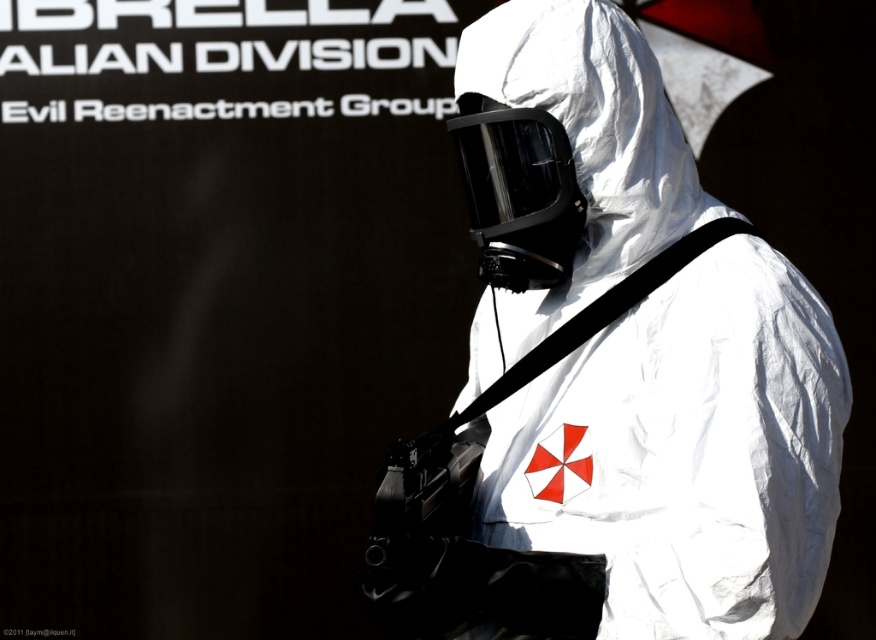
You are a security guard in a high security facility. You need to locate the white matte hazmat suit at center. According to the coordinates provided, where would you find it?

The white matte hazmat suit at center is located at coordinates point [612,374].

You are a security guard in a restricted area. You see a white matte hazmat suit at center and a white matte helmet at center. Which object is located to the left of the other?

The white matte hazmat suit at center is positioned on the right side of the white matte helmet at center, so the white matte helmet at center is to the left of the white matte hazmat suit at center.

You are designing a storage locker for equipment. The locker has a compartment that is exactly the same width as the white matte helmet at center. Can the white matte hazmat suit at center fit into this compartment?

The white matte hazmat suit at center is wider than the white matte helmet at center, so it cannot fit into the compartment designed for the helmet.